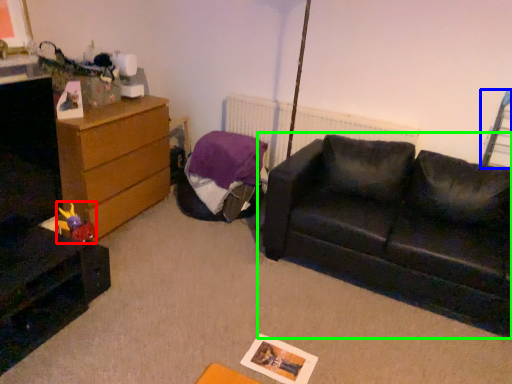
Question: Which object is the farthest from toy (highlighted by a red box)? Choose among these: swivel chair (highlighted by a blue box) or studio couch (highlighted by a green box).

Choices:
 (A) swivel chair
 (B) studio couch

Answer: (A)